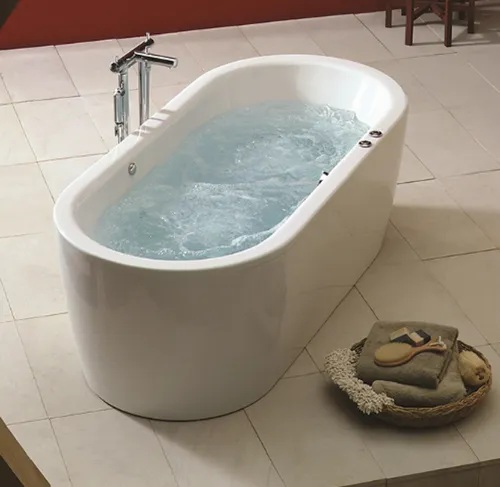
What are the coordinates of `moppy cloth` in the screenshot? It's located at (357, 386).